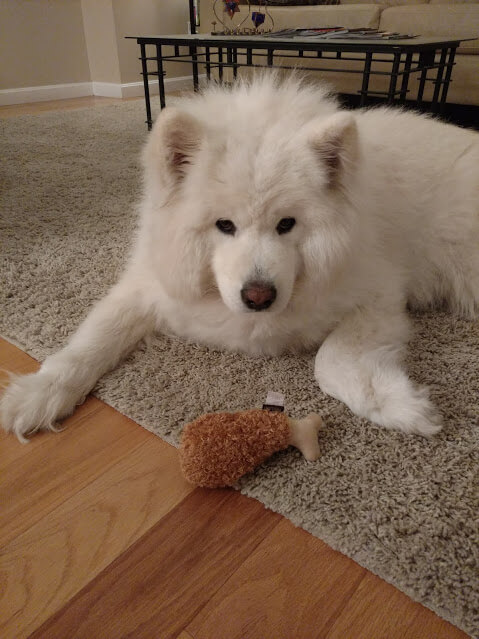
Identify the location of magazines on top of table. The image size is (479, 639). (328, 29).